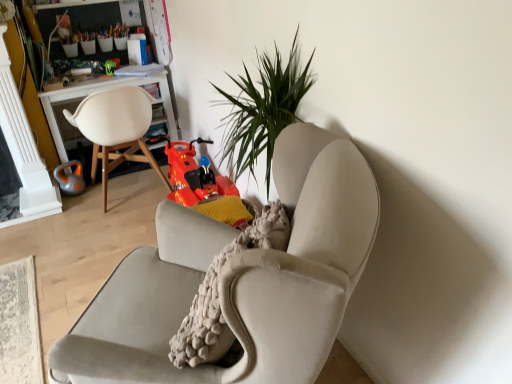
The height and width of the screenshot is (384, 512). Find the location of `vacant area that lies to the right of orange rubber kettlebell at left, which is the second toy from top to bottom`. vacant area that lies to the right of orange rubber kettlebell at left, which is the second toy from top to bottom is located at coordinates (100, 189).